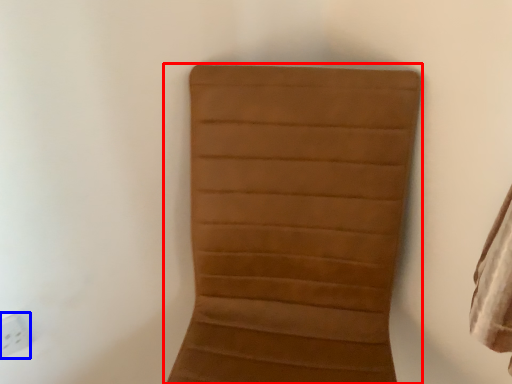
Question: Among these objects, which one is farthest to the camera, furniture (highlighted by a red box) or electric outlet (highlighted by a blue box)?

Choices:
 (A) furniture
 (B) electric outlet

Answer: (B)